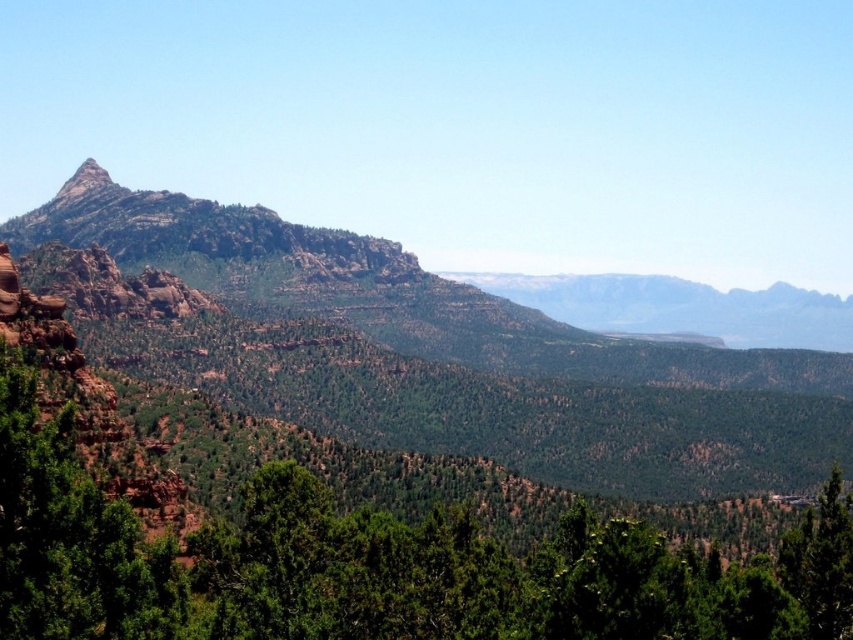
You are an outdoor enthusiast planning a hiking route. You see the rustic rock mountain range at left and the rustic rock peak at upper left. Which mountain feature is located to the right of the other?

The rustic rock mountain range at left is positioned on the right side of rustic rock peak at upper left, meaning the mountain range is to the right of the peak.

You are planning a hiking route and need to decide whether to go around the rustic rock mountain range at left or through the area near the green textured tree at center. Based on their sizes, which path would require more effort due to the terrain?

The rustic rock mountain range at left is larger than the green textured tree at center, so the path around the rustic rock mountain range at left would require more effort due to its size and rugged terrain.